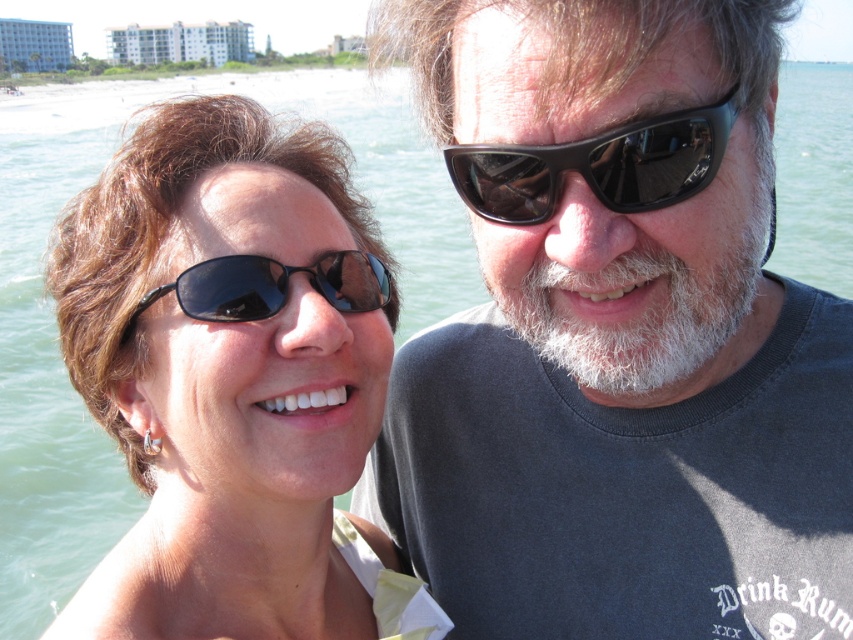
Is matte black sunglasses at left smaller than black shiny sunglasses at upper right?

No.

Between matte black sunglasses at left and black shiny sunglasses at upper right, which one has less height?

black shiny sunglasses at upper right

Does point (245, 308) come farther from viewer compared to point (517, 166)?

Yes, point (245, 308) is farther from viewer.

You are a GUI agent. You are given a task and a screenshot of the screen. Output one action in this format:
    pyautogui.click(x=<x>, y=<y>)
    Task: Click on the matte black sunglasses at left
    The width and height of the screenshot is (853, 640).
    Given the screenshot: What is the action you would take?
    [231, 378]

Is matte black sunglasses at left shorter than black matte sunglasses at left?

In fact, matte black sunglasses at left may be taller than black matte sunglasses at left.

How much distance is there between matte black sunglasses at left and black matte sunglasses at left?

matte black sunglasses at left and black matte sunglasses at left are 34.60 centimeters apart.

Who is more distant from viewer, (216, 260) or (178, 300)?

The point (178, 300) is more distant.

Image resolution: width=853 pixels, height=640 pixels. I want to click on matte black sunglasses at left, so click(231, 378).

Is matte black sunglasses at upper center above matte black sunglasses at left?

Correct, matte black sunglasses at upper center is located above matte black sunglasses at left.

Does matte black sunglasses at upper center have a smaller size compared to matte black sunglasses at left?

Actually, matte black sunglasses at upper center might be larger than matte black sunglasses at left.

Is point (480, 515) less distant than point (125, 186)?

No, (480, 515) is further to viewer.

Identify the location of matte black sunglasses at upper center. The image size is (853, 640). (616, 336).